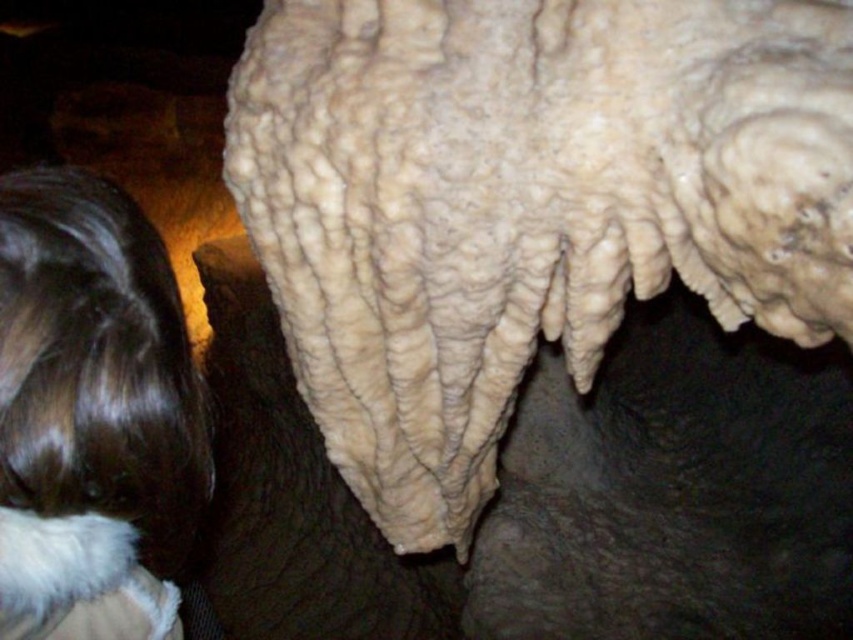
Question: Does white textured rock at center appear on the right side of brown hair at upper left?

Choices:
 (A) yes
 (B) no

Answer: (A)

Question: Among these points, which one is farthest from the camera?

Choices:
 (A) (552, 81)
 (B) (51, 342)

Answer: (A)

Question: Which point appears farthest from the camera in this image?

Choices:
 (A) (344, 248)
 (B) (103, 268)

Answer: (A)

Question: Can you confirm if white textured rock at center is positioned above brown hair at upper left?

Choices:
 (A) no
 (B) yes

Answer: (B)

Question: Can you confirm if white textured rock at center is positioned above brown hair at upper left?

Choices:
 (A) no
 (B) yes

Answer: (B)